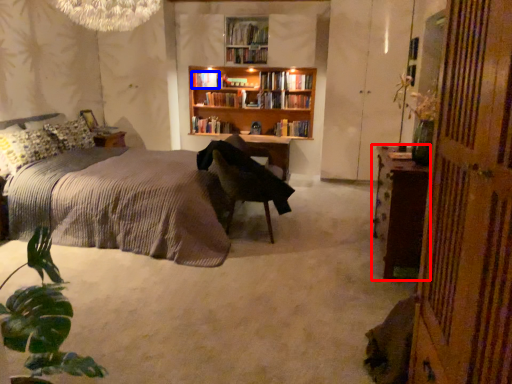
Question: Among these objects, which one is nearest to the camera, nightstand (highlighted by a red box) or book (highlighted by a blue box)?

Choices:
 (A) nightstand
 (B) book

Answer: (A)